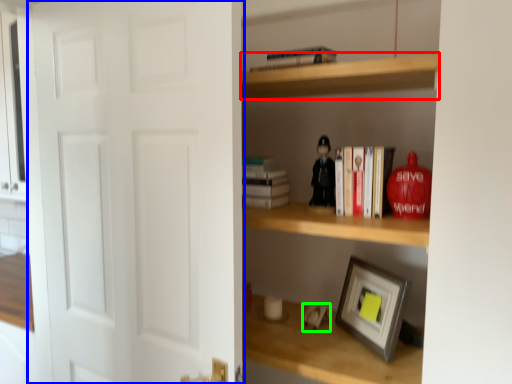
Question: Which object is the farthest from cabinet (highlighted by a red box)? Choose among these: door (highlighted by a blue box) or toy (highlighted by a green box).

Choices:
 (A) door
 (B) toy

Answer: (B)